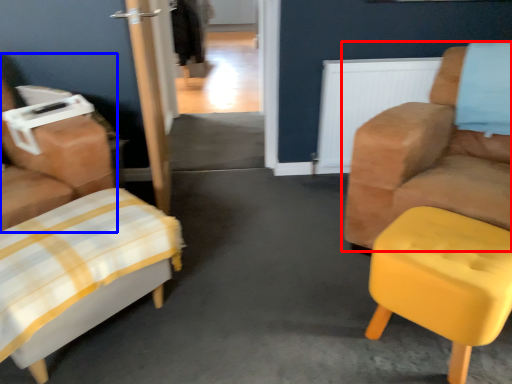
Question: Which object appears closest to the camera in this image, chair (highlighted by a red box) or chair (highlighted by a blue box)?

Choices:
 (A) chair
 (B) chair

Answer: (A)